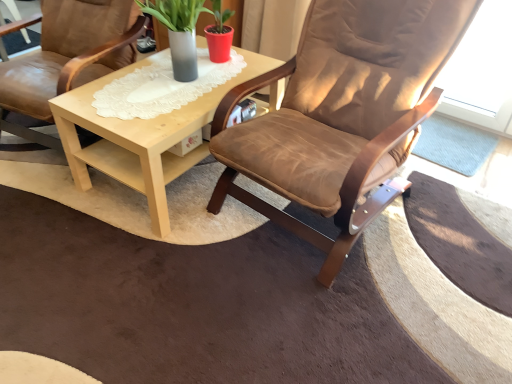
Find the location of a particular element. The width and height of the screenshot is (512, 384). vacant area situated below matte gray vase at center (from a real-world perspective) is located at coordinates (173, 75).